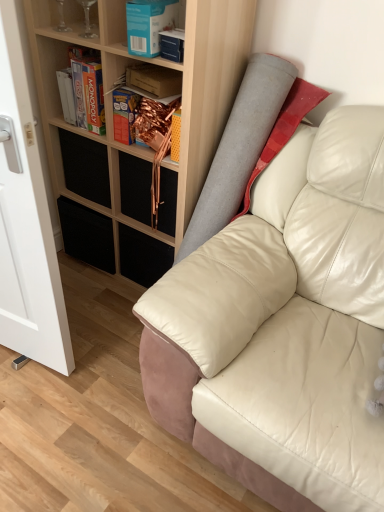
This screenshot has width=384, height=512. What are the coordinates of `matte cardboard box at upper center, the 1th book in the back-to-front sequence` in the screenshot? It's located at (154, 79).

You are a GUI agent. You are given a task and a screenshot of the screen. Output one action in this format:
    pyautogui.click(x=<x>, y=<y>)
    Task: Click on the white glossy glass door at left
    
    Given the screenshot: What is the action you would take?
    pyautogui.click(x=26, y=222)

This screenshot has height=512, width=384. What do you see at coordinates (67, 19) in the screenshot?
I see `transparent glass wine glasses at upper left, marked as the 1th shelf in a left-to-right arrangement` at bounding box center [67, 19].

Identify the location of blue cardboard box at upper center, the 2th book from the back. This screenshot has height=512, width=384. (149, 24).

Image resolution: width=384 pixels, height=512 pixels. What do you see at coordinates (284, 326) in the screenshot? I see `white leather couch at center` at bounding box center [284, 326].

What are the coordinates of `black matte drawer at upper left, which is counted as the 1th drawer, starting from the left` in the screenshot? It's located at (85, 167).

How many degrees apart are the facing directions of wooden bookshelf at upper left, the 1th shelf positioned from the right, and white glossy glass door at left?

8.14 degrees separate the facing orientations of wooden bookshelf at upper left, the 1th shelf positioned from the right, and white glossy glass door at left.

Is wooden bookshelf at upper left, which is counted as the 1th shelf, starting from the bottom, further to the viewer compared to white glossy glass door at left?

Yes, wooden bookshelf at upper left, which is counted as the 1th shelf, starting from the bottom, is further from the viewer.

From the image's perspective, which is above, wooden bookshelf at upper left, the 1th shelf positioned from the front, or white glossy glass door at left?

wooden bookshelf at upper left, the 1th shelf positioned from the front, appears higher in the image.

Looking at this image, which object is positioned more to the left, wooden bookshelf at upper left, marked as the 2th shelf in a top-to-bottom arrangement, or white glossy glass door at left?

white glossy glass door at left is more to the left.

In the scene shown: Considering the positions of objects black matte drawer at upper left, the second drawer from the right, and matte cardboard box at upper center, which is counted as the 2th book, starting from the front, in the image provided, who is more to the right, black matte drawer at upper left, the second drawer from the right, or matte cardboard box at upper center, which is counted as the 2th book, starting from the front,?

From the viewer's perspective, matte cardboard box at upper center, which is counted as the 2th book, starting from the front, appears more on the right side.

From a real-world perspective, is black matte drawer at upper left, which is counted as the 1th drawer, starting from the left, physically located above or below matte cardboard box at upper center, which is counted as the 2th book, starting from the front?

From a real-world perspective, black matte drawer at upper left, which is counted as the 1th drawer, starting from the left, is physically below matte cardboard box at upper center, which is counted as the 2th book, starting from the front.

How different are the orientations of black matte drawer at upper left, which is counted as the 1th drawer, starting from the left, and matte cardboard box at upper center, the 1th book in the back-to-front sequence, in degrees?

The angle between the facing direction of black matte drawer at upper left, which is counted as the 1th drawer, starting from the left, and the facing direction of matte cardboard box at upper center, the 1th book in the back-to-front sequence, is 2.39 degrees.

Is black matte drawer at upper left, the second drawer from the right, thinner than matte cardboard box at upper center, the 1th book in the back-to-front sequence?

No, black matte drawer at upper left, the second drawer from the right, is not thinner than matte cardboard box at upper center, the 1th book in the back-to-front sequence.

From the image's perspective, who appears lower, white leather couch at center or wooden bookshelf at upper left, which is counted as the 2th shelf, starting from the left?

white leather couch at center is shown below in the image.

What's the angular difference between white leather couch at center and wooden bookshelf at upper left, the 1th shelf positioned from the front,'s facing directions?

The angle between the facing direction of white leather couch at center and the facing direction of wooden bookshelf at upper left, the 1th shelf positioned from the front, is 0.345 degrees.

Is white leather couch at center to the left or to the right of wooden bookshelf at upper left, the 1th shelf positioned from the front, in the image?

In the image, white leather couch at center appears on the right side of wooden bookshelf at upper left, the 1th shelf positioned from the front.

Is metallic gold drawer at center, positioned as the first drawer in right-to-left order, surrounded by transparent glass wine glasses at upper left, acting as the 2th shelf starting from the front?

Actually, metallic gold drawer at center, positioned as the first drawer in right-to-left order, is outside transparent glass wine glasses at upper left, acting as the 2th shelf starting from the front.

From a real-world perspective, does transparent glass wine glasses at upper left, which is the first shelf in back-to-front order, sit lower than metallic gold drawer at center, which is the 2th drawer from left to right?

No.

Considering their positions, is transparent glass wine glasses at upper left, which is the 2th shelf in bottom-to-top order, located in front of or behind metallic gold drawer at center, positioned as the first drawer in right-to-left order?

transparent glass wine glasses at upper left, which is the 2th shelf in bottom-to-top order, is positioned closer to the viewer than metallic gold drawer at center, positioned as the first drawer in right-to-left order.

In terms of width, does transparent glass wine glasses at upper left, which is the first shelf in back-to-front order, look wider or thinner when compared to metallic gold drawer at center, positioned as the first drawer in right-to-left order?

transparent glass wine glasses at upper left, which is the first shelf in back-to-front order, is thinner than metallic gold drawer at center, positioned as the first drawer in right-to-left order.

The image size is (384, 512). Find the location of `drawer that is the 2nd one when counting backward from the wooden bookshelf at upper left, the second shelf when ordered from back to front`. drawer that is the 2nd one when counting backward from the wooden bookshelf at upper left, the second shelf when ordered from back to front is located at coordinates (85, 167).

Can you tell me how much wooden bookshelf at upper left, marked as the 2th shelf in a top-to-bottom arrangement, and black matte drawer at upper left, which is counted as the 1th drawer, starting from the left, differ in facing direction?

0.504 degrees separate the facing orientations of wooden bookshelf at upper left, marked as the 2th shelf in a top-to-bottom arrangement, and black matte drawer at upper left, which is counted as the 1th drawer, starting from the left.

Is wooden bookshelf at upper left, the 1th shelf positioned from the right, wider or thinner than black matte drawer at upper left, the second drawer from the right?

Considering their sizes, wooden bookshelf at upper left, the 1th shelf positioned from the right, looks broader than black matte drawer at upper left, the second drawer from the right.

Is the surface of wooden bookshelf at upper left, the 1th shelf positioned from the front, in direct contact with black matte drawer at upper left, which is counted as the 1th drawer, starting from the left?

There is a gap between wooden bookshelf at upper left, the 1th shelf positioned from the front, and black matte drawer at upper left, which is counted as the 1th drawer, starting from the left.

Locate an element on the screen. Image resolution: width=384 pixels, height=512 pixels. glass door that appears in front of the transparent glass wine glasses at upper left, marked as the 1th shelf in a left-to-right arrangement is located at coordinates (26, 222).

Considering the relative sizes of transparent glass wine glasses at upper left, acting as the 2th shelf starting from the front, and white glossy glass door at left in the image provided, is transparent glass wine glasses at upper left, acting as the 2th shelf starting from the front, smaller than white glossy glass door at left?

Yes, transparent glass wine glasses at upper left, acting as the 2th shelf starting from the front, is smaller than white glossy glass door at left.

Is transparent glass wine glasses at upper left, which is the 2th shelf in bottom-to-top order, positioned with its back to white glossy glass door at left?

No, white glossy glass door at left is not at the back of transparent glass wine glasses at upper left, which is the 2th shelf in bottom-to-top order.

Considering the sizes of transparent glass wine glasses at upper left, the 2th shelf when ordered from right to left, and white glossy glass door at left in the image, is transparent glass wine glasses at upper left, the 2th shelf when ordered from right to left, wider or thinner than white glossy glass door at left?

Clearly, transparent glass wine glasses at upper left, the 2th shelf when ordered from right to left, has less width compared to white glossy glass door at left.

Which is correct: metallic gold drawer at center, which is the 2th drawer from left to right, is inside matte cardboard box at upper center, the 1th book in the back-to-front sequence, or outside of it?

metallic gold drawer at center, which is the 2th drawer from left to right, exists outside the volume of matte cardboard box at upper center, the 1th book in the back-to-front sequence.

Which is in front, point (176, 193) or point (127, 80)?

The point (127, 80) is more forward.

Does metallic gold drawer at center, positioned as the first drawer in right-to-left order, have a smaller size compared to matte cardboard box at upper center, the 1th book in the back-to-front sequence?

No.

The height and width of the screenshot is (512, 384). I want to click on drawer that is the 2nd object located below the matte cardboard box at upper center, which is counted as the 2th book, starting from the front (from the image's perspective), so click(x=135, y=187).

At what (x,y) coordinates should I click in order to perform the action: click on glass door that appears on the left of wooden bookshelf at upper left, marked as the 2th shelf in a top-to-bottom arrangement. Please return your answer as a coordinate pair (x, y). Image resolution: width=384 pixels, height=512 pixels. Looking at the image, I should click on (26, 222).

Image resolution: width=384 pixels, height=512 pixels. Identify the location of the 1st book directly above the black matte drawer at upper left, which is counted as the 1th drawer, starting from the left (from a real-world perspective). (154, 79).

Which object lies nearer to the anchor point matte cardboard box at upper center, the 1th book in the back-to-front sequence, blue cardboard box at upper center, the 2th book from the back, or transparent glass wine glasses at upper left, arranged as the 1th shelf when viewed from the top?

The object closer to matte cardboard box at upper center, the 1th book in the back-to-front sequence, is blue cardboard box at upper center, the 2th book from the back.

Based on their spatial positions, is transparent glass wine glasses at upper left, arranged as the 1th shelf when viewed from the top, or white leather couch at center closer to metallic gold drawer at center, which is the 2th drawer from left to right?

transparent glass wine glasses at upper left, arranged as the 1th shelf when viewed from the top, is closer to metallic gold drawer at center, which is the 2th drawer from left to right.

From the image, which object appears to be nearer to wooden bookshelf at upper left, the 1th shelf positioned from the right, blue cardboard box at upper center, the 2th book from the back, or black matte drawer at upper left, which is counted as the 1th drawer, starting from the left?

black matte drawer at upper left, which is counted as the 1th drawer, starting from the left, is closer to wooden bookshelf at upper left, the 1th shelf positioned from the right.

From the image, which object appears to be nearer to metallic gold drawer at center, which is the 2th drawer from left to right, matte cardboard box at upper center, which is counted as the 2th book, starting from the front, or white leather couch at center?

matte cardboard box at upper center, which is counted as the 2th book, starting from the front, is closer to metallic gold drawer at center, which is the 2th drawer from left to right.

Looking at this image, based on their spatial positions, is wooden bookshelf at upper left, which is counted as the 2th shelf, starting from the left, or black matte drawer at upper left, which is counted as the 1th drawer, starting from the left, further from metallic gold drawer at center, which is the 2th drawer from left to right?

The object further to metallic gold drawer at center, which is the 2th drawer from left to right, is black matte drawer at upper left, which is counted as the 1th drawer, starting from the left.

Looking at the image, which one is located further to white leather couch at center, transparent glass wine glasses at upper left, marked as the 1th shelf in a left-to-right arrangement, or blue cardboard box at upper center, the 2th book from the back?

transparent glass wine glasses at upper left, marked as the 1th shelf in a left-to-right arrangement, is further to white leather couch at center.

Which object lies nearer to the anchor point black matte drawer at upper left, the second drawer from the right, matte cardboard box at upper center, which is counted as the 2th book, starting from the front, or blue cardboard box at upper center, which is the 1th book from front to back?

Among the two, matte cardboard box at upper center, which is counted as the 2th book, starting from the front, is located nearer to black matte drawer at upper left, the second drawer from the right.

From the image, which object appears to be nearer to white leather couch at center, metallic gold drawer at center, which is the 2th drawer from left to right, or matte cardboard box at upper center, which is counted as the 2th book, starting from the front?

metallic gold drawer at center, which is the 2th drawer from left to right, is positioned closer to the anchor white leather couch at center.

At what (x,y) coordinates should I click in order to perform the action: click on shelf between blue cardboard box at upper center, which is the 1th book from front to back, and white glossy glass door at left from top to bottom. Please return your answer as a coordinate pair (x, y). The image size is (384, 512). Looking at the image, I should click on coord(134,144).

Locate an element on the screen. The image size is (384, 512). drawer between white leather couch at center and black matte drawer at upper left, the second drawer from the right, in the front-back direction is located at coordinates (135, 187).

Locate an element on the screen. glass door between white leather couch at center and metallic gold drawer at center, which is the 2th drawer from left to right, in the front-back direction is located at coordinates (26, 222).

Identify the location of book between blue cardboard box at upper center, the 2th book from the back, and metallic gold drawer at center, positioned as the first drawer in right-to-left order, from top to bottom. (154, 79).